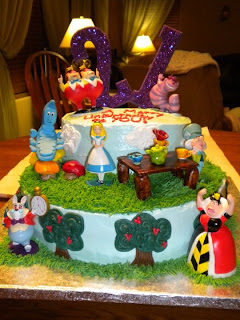
At what (x,y) coordinates should I click in order to perform the action: click on clock. Please return your answer as a coordinate pair (x, y). The image size is (240, 320). Looking at the image, I should click on (42, 205).